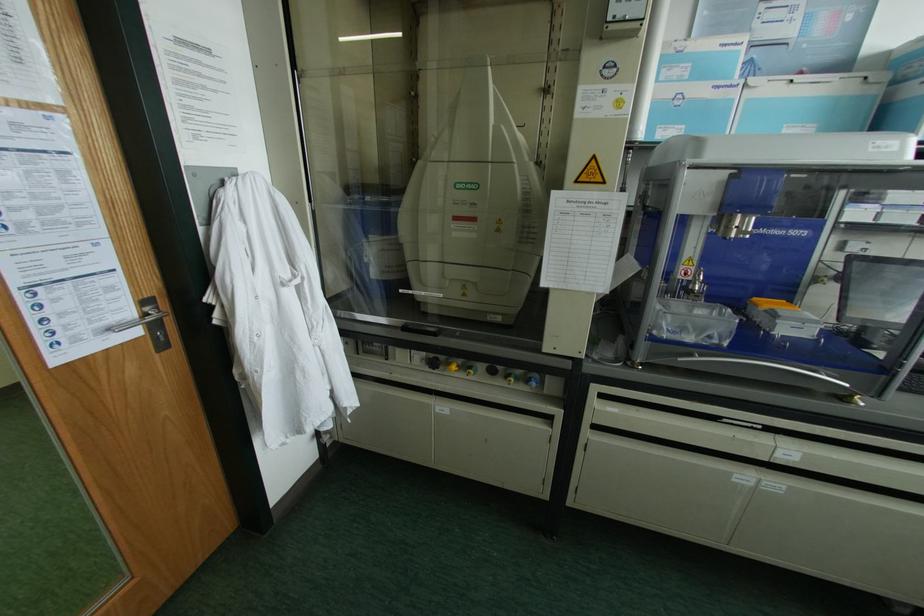
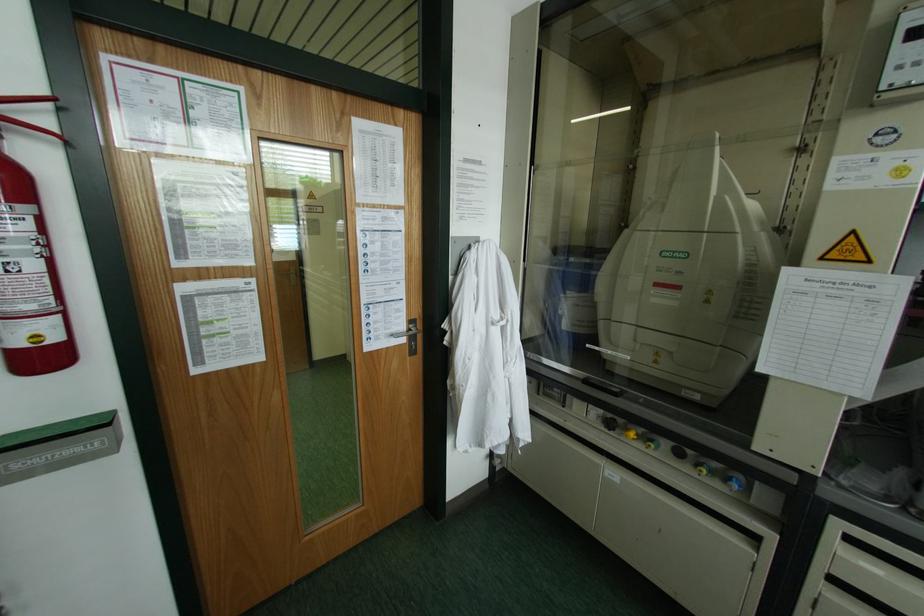
Find the pixel in the second image that matches point 545,90 in the first image.

(800, 148)